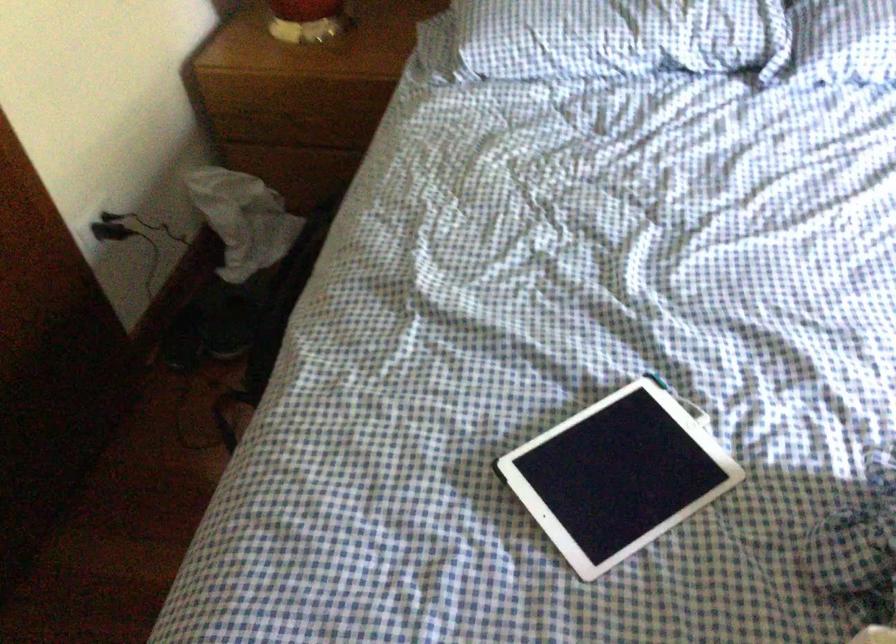
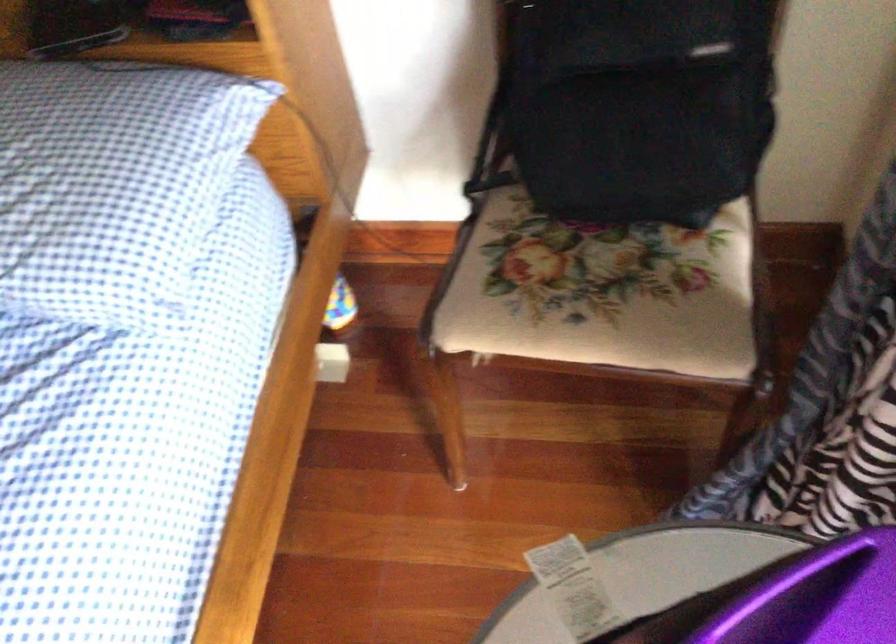
Question: What movement of the cameraman would produce the second image?

Choices:
 (A) Left
 (B) Right
 (C) Forward
 (D) Backward

Answer: (B)